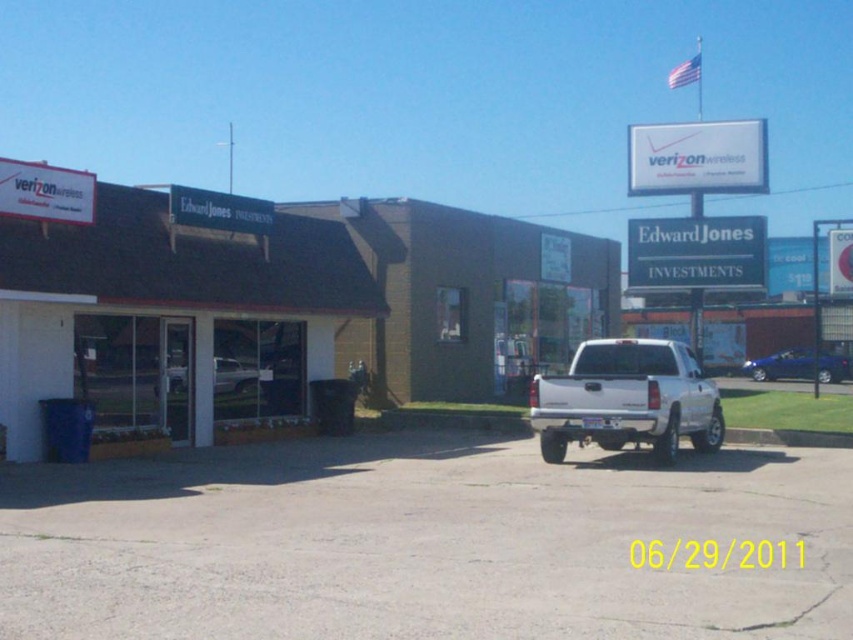
Does white brick storefront at left have a lesser width compared to silver metallic pickup truck at center?

No, white brick storefront at left is not thinner than silver metallic pickup truck at center.

This screenshot has height=640, width=853. Describe the element at coordinates (163, 307) in the screenshot. I see `white brick storefront at left` at that location.

The image size is (853, 640). I want to click on white brick storefront at left, so click(163, 307).

Between white brick storefront at left and white matte truck at center, which one appears on the left side from the viewer's perspective?

white matte truck at center is more to the left.

Is point (59, 260) positioned behind point (235, 374)?

No, (59, 260) is closer to viewer.

Image resolution: width=853 pixels, height=640 pixels. I want to click on white brick storefront at left, so click(x=163, y=307).

How distant is silver metallic pickup truck at center from white matte truck at center?

silver metallic pickup truck at center and white matte truck at center are 24.28 feet apart from each other.

Is silver metallic pickup truck at center thinner than white matte truck at center?

No, silver metallic pickup truck at center is not thinner than white matte truck at center.

Identify the location of silver metallic pickup truck at center. (625, 400).